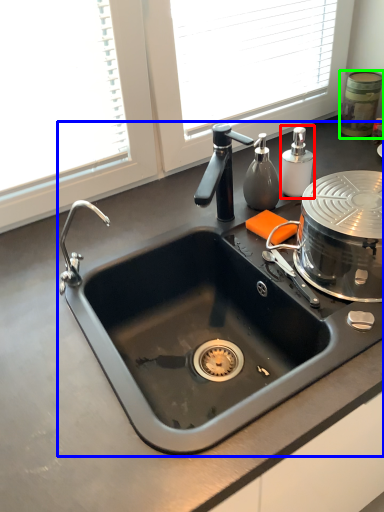
Question: Considering the real-world distances, which object is farthest from soap dispenser (highlighted by a red box)? sink (highlighted by a blue box) or appliance (highlighted by a green box)?

Choices:
 (A) sink
 (B) appliance

Answer: (A)